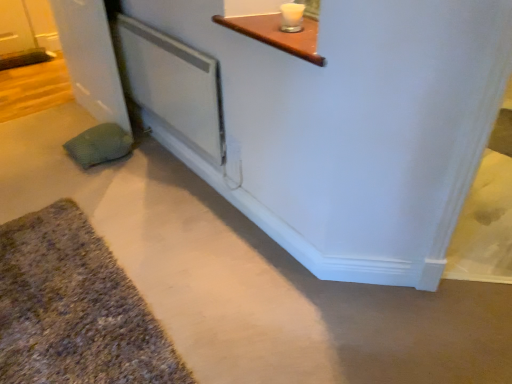
Question: Is textured gray bath mat at lower left at the left side of white plastic screen door at center?

Choices:
 (A) yes
 (B) no

Answer: (A)

Question: Is textured gray bath mat at lower left located outside white plastic screen door at center?

Choices:
 (A) no
 (B) yes

Answer: (B)

Question: Is textured gray bath mat at lower left at the right side of white plastic screen door at center?

Choices:
 (A) no
 (B) yes

Answer: (A)

Question: From the image's perspective, would you say textured gray bath mat at lower left is shown under white plastic screen door at center?

Choices:
 (A) no
 (B) yes

Answer: (B)

Question: From a real-world perspective, is textured gray bath mat at lower left physically above white plastic screen door at center?

Choices:
 (A) no
 (B) yes

Answer: (A)

Question: From the image's perspective, does textured gray bath mat at lower left appear higher than white plastic screen door at center?

Choices:
 (A) yes
 (B) no

Answer: (B)

Question: From the image's perspective, is green textured pillow at lower left on textured gray bath mat at lower left?

Choices:
 (A) no
 (B) yes

Answer: (B)

Question: Could you tell me if green textured pillow at lower left is turned towards textured gray bath mat at lower left?

Choices:
 (A) no
 (B) yes

Answer: (A)

Question: Is green textured pillow at lower left to the left of textured gray bath mat at lower left from the viewer's perspective?

Choices:
 (A) yes
 (B) no

Answer: (A)

Question: Is green textured pillow at lower left thinner than textured gray bath mat at lower left?

Choices:
 (A) yes
 (B) no

Answer: (A)

Question: From a real-world perspective, is green textured pillow at lower left positioned under textured gray bath mat at lower left based on gravity?

Choices:
 (A) no
 (B) yes

Answer: (A)

Question: Can you confirm if green textured pillow at lower left is smaller than textured gray bath mat at lower left?

Choices:
 (A) yes
 (B) no

Answer: (A)

Question: Would you say textured gray bath mat at lower left contains green textured pillow at lower left?

Choices:
 (A) yes
 (B) no

Answer: (B)